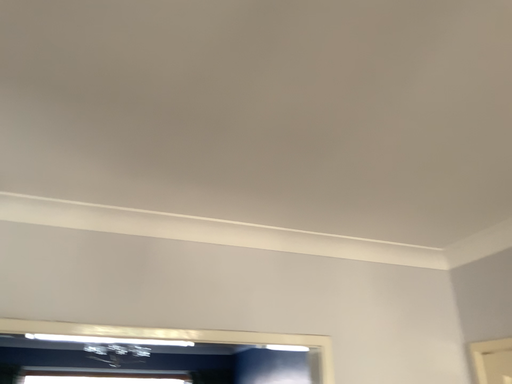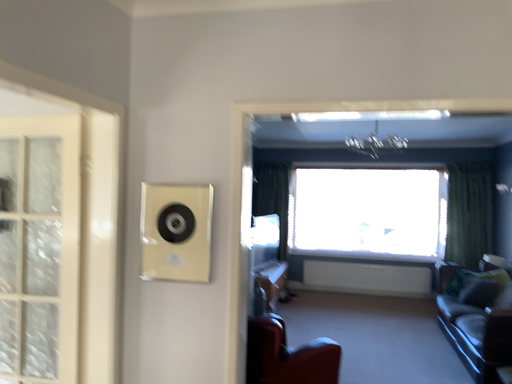
Question: How did the camera likely rotate when shooting the video?

Choices:
 (A) rotated upward
 (B) rotated downward

Answer: (B)